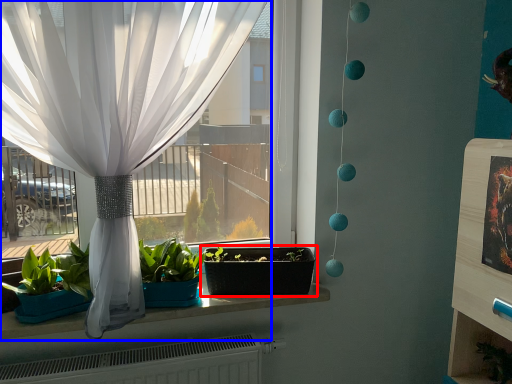
Question: Which object is further to the camera taking this photo, flowerpot (highlighted by a red box) or curtain (highlighted by a blue box)?

Choices:
 (A) flowerpot
 (B) curtain

Answer: (A)